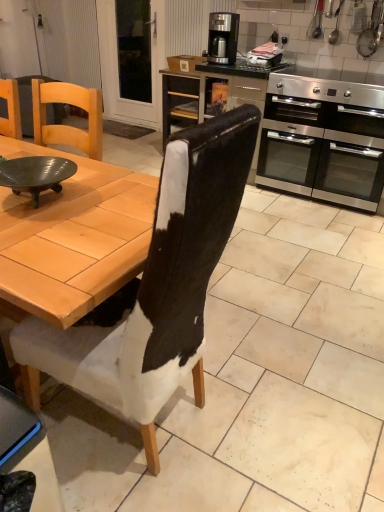
Locate an element on the screen. This screenshot has width=384, height=512. vacant region below matte black bowl at left (from a real-world perspective) is located at coordinates (44, 198).